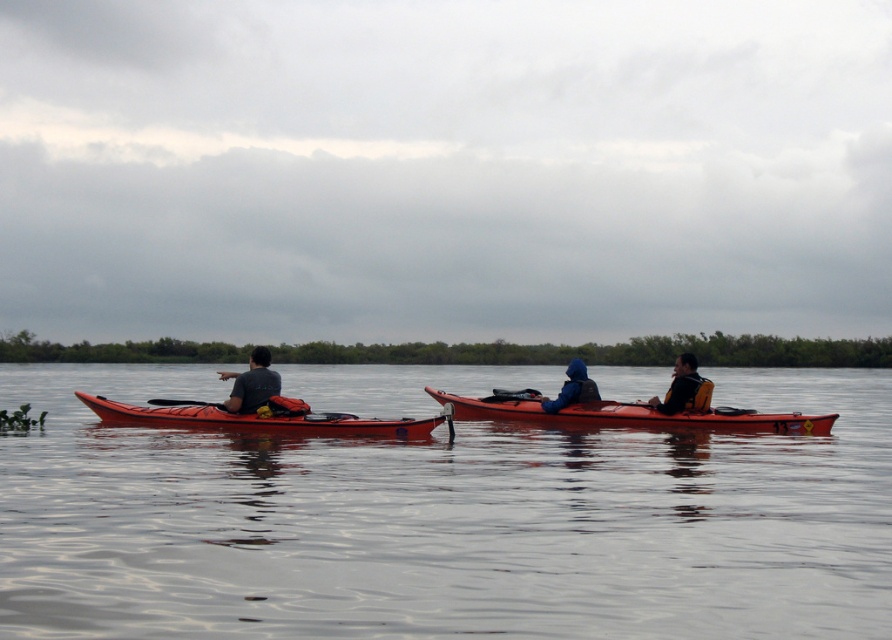
Can you confirm if matte black kayak at left is wider than yellow life vest at right?

No.

At what (x,y) coordinates should I click in order to perform the action: click on matte black kayak at left. Please return your answer as a coordinate pair (x, y). Image resolution: width=892 pixels, height=640 pixels. Looking at the image, I should click on (252, 384).

Is point (255, 353) closer to viewer compared to point (671, 392)?

That is True.

I want to click on matte black kayak at left, so click(252, 384).

Who is lower down, transparent water at center or matte orange canoe at center?

matte orange canoe at center is below.

Does transparent water at center appear on the left side of matte orange canoe at center?

Indeed, transparent water at center is positioned on the left side of matte orange canoe at center.

Where is `transparent water at center`? transparent water at center is located at coordinates (444, 522).

You are a GUI agent. You are given a task and a screenshot of the screen. Output one action in this format:
    pyautogui.click(x=<x>, y=<y>)
    Task: Click on the transparent water at center
    This screenshot has height=640, width=892.
    Given the screenshot: What is the action you would take?
    pyautogui.click(x=444, y=522)

Between matte orange canoe at center and blue matte jacket at center, which one is positioned higher?

blue matte jacket at center is above.

Measure the distance between point (671,417) and camera.

A distance of 16.72 meters exists between point (671,417) and camera.

Where is `matte orange canoe at center`? The width and height of the screenshot is (892, 640). matte orange canoe at center is located at coordinates (630, 413).